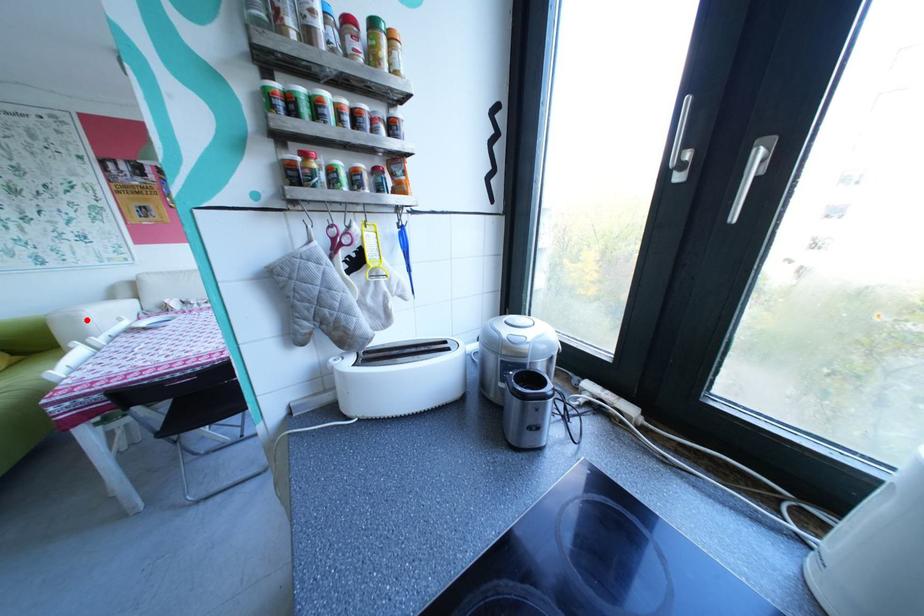
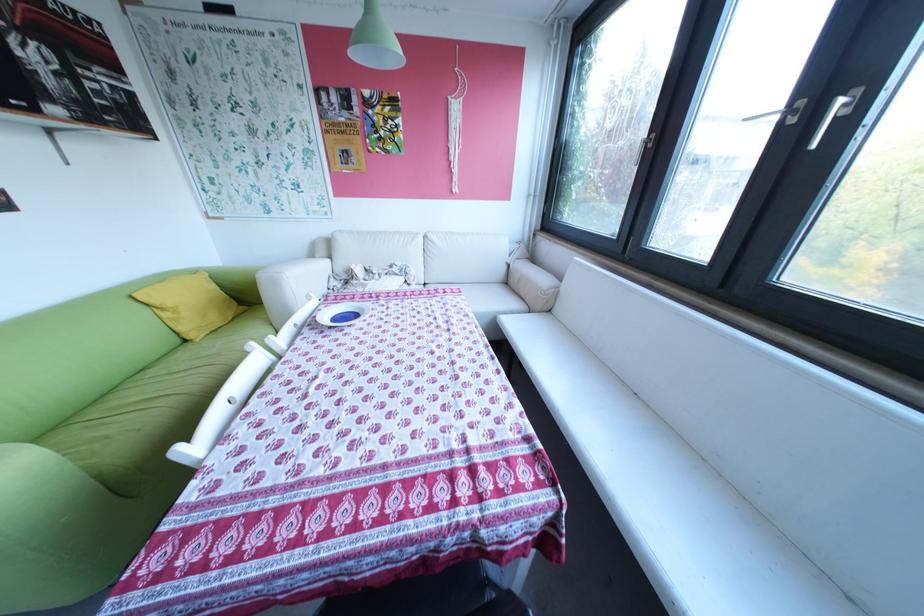
Find the pixel in the second image that matches the highlighted location in the first image.

(288, 283)